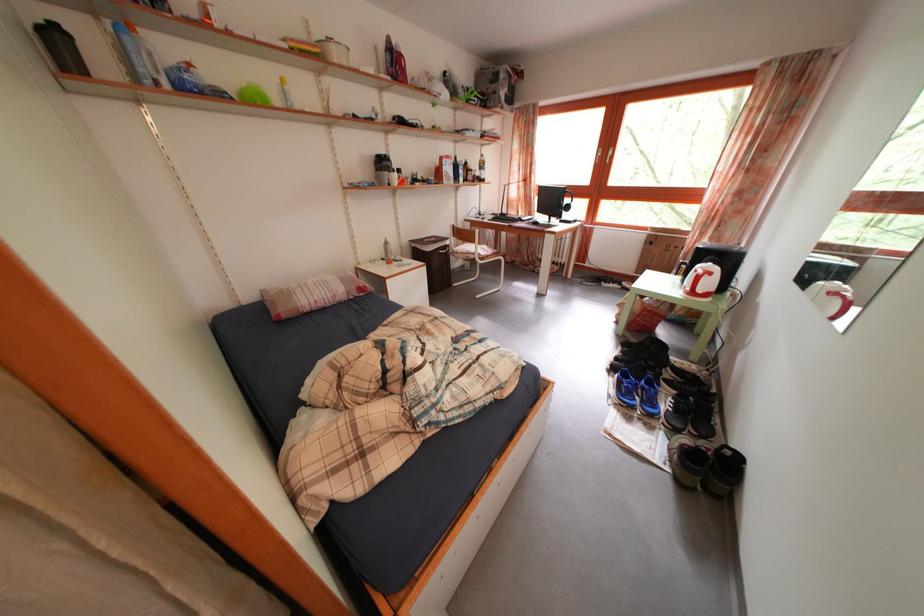
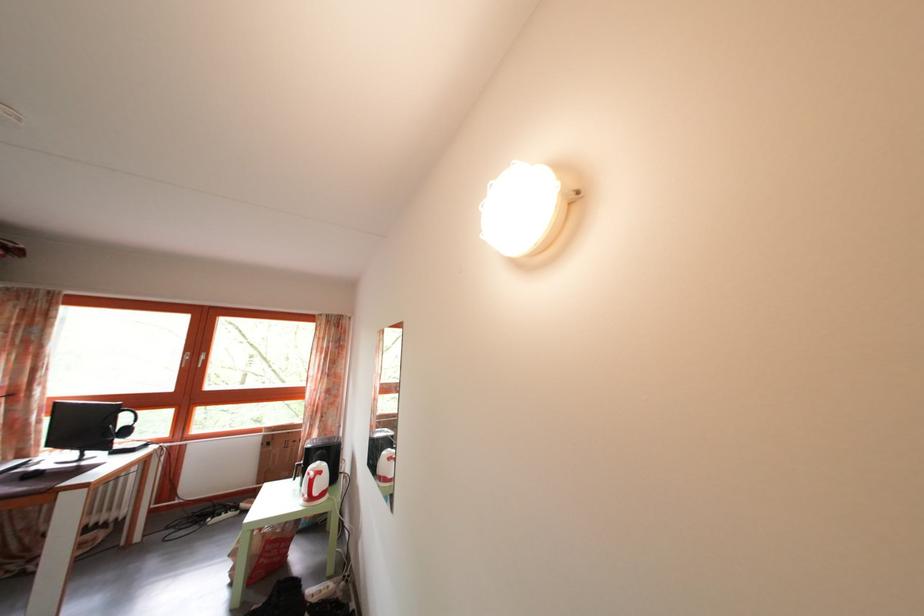
Where in the second image is the point corresponding to the point at 611,160 from the first image?

(199, 363)